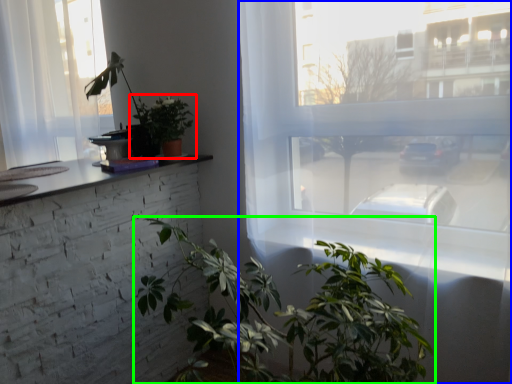
Question: Considering the real-world distances, which object is closest to houseplant (highlighted by a red box)? window (highlighted by a blue box) or houseplant (highlighted by a green box).

Choices:
 (A) window
 (B) houseplant

Answer: (A)